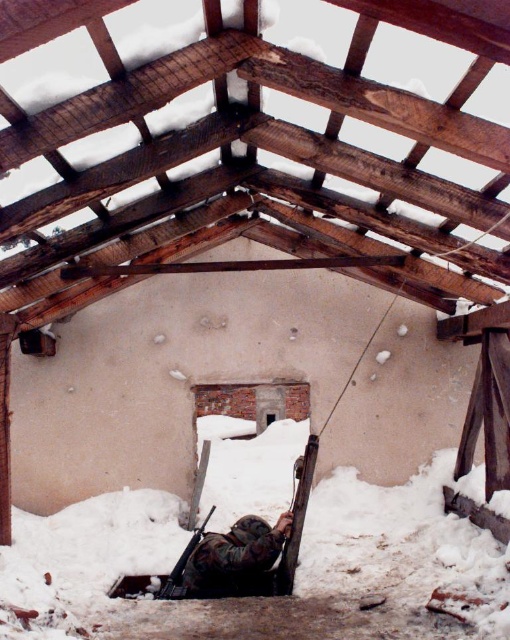
Question: Which point is closer to the camera?

Choices:
 (A) camouflage fabric uniform at center
 (B) brown wooden beams at upper center

Answer: (B)

Question: Which point is farther from the camera taking this photo?

Choices:
 (A) (412, 509)
 (B) (234, 570)

Answer: (A)

Question: Is white powdery snow at lower center bigger than camouflage fabric rifle at lower center?

Choices:
 (A) yes
 (B) no

Answer: (A)

Question: Does white powdery snow at lower center appear on the left side of matte black rifle at center?

Choices:
 (A) no
 (B) yes

Answer: (B)

Question: In this image, where is brown wooden beams at upper center located relative to camouflage fabric uniform at center?

Choices:
 (A) left
 (B) right

Answer: (B)

Question: Which point is farther to the camera?

Choices:
 (A) white powdery snow at lower center
 (B) matte black rifle at center

Answer: (B)